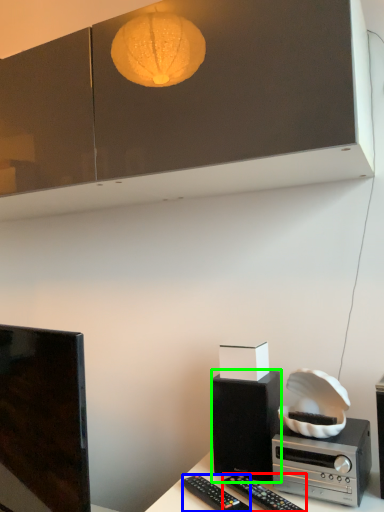
Question: Which object is positioned closest to remote control (highlighted by a red box)? Select from remote control (highlighted by a blue box) and loudspeaker (highlighted by a green box).

Choices:
 (A) remote control
 (B) loudspeaker

Answer: (A)